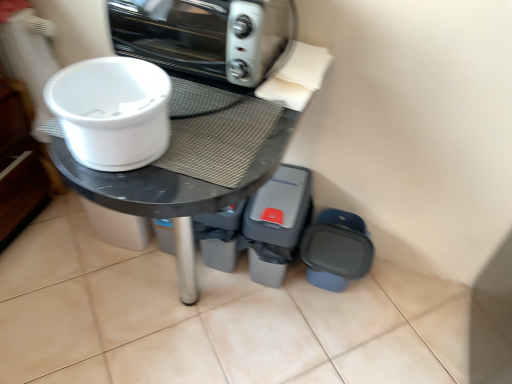
This screenshot has width=512, height=384. What are the coordinates of `free space in front of matte plastic container at lower right, the second appliance viewed from the left` in the screenshot? It's located at (332, 342).